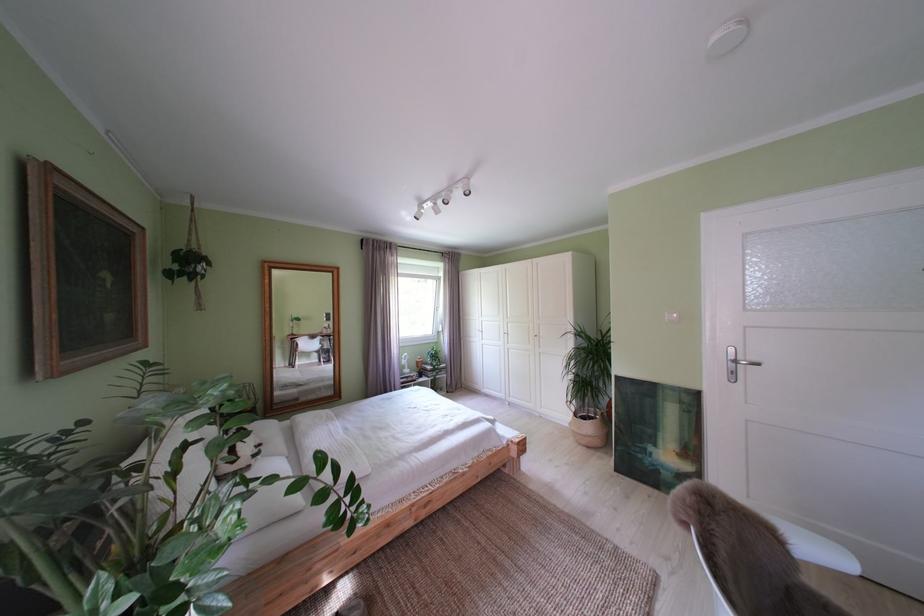
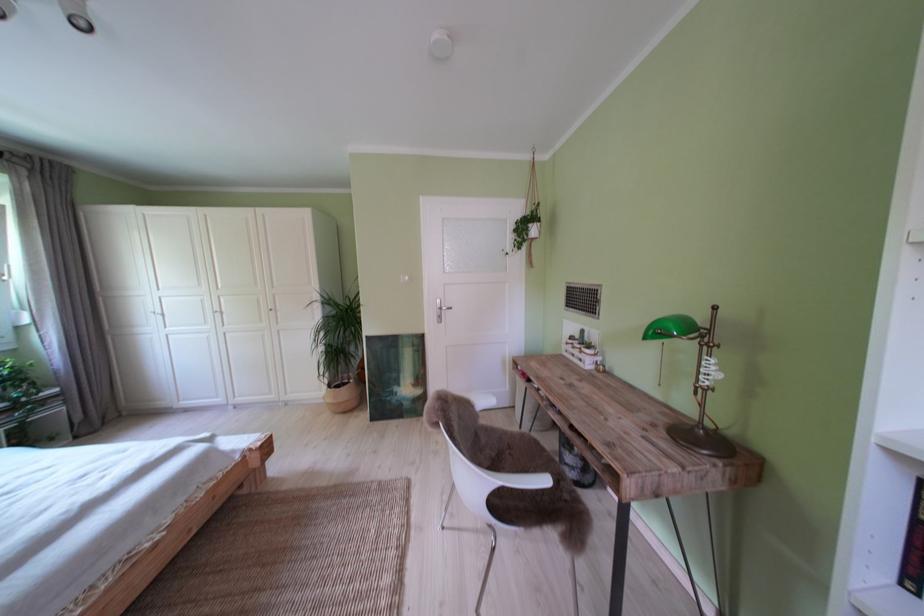
Where in the second image is the point corresponding to point 650,461 from the first image?

(399, 403)